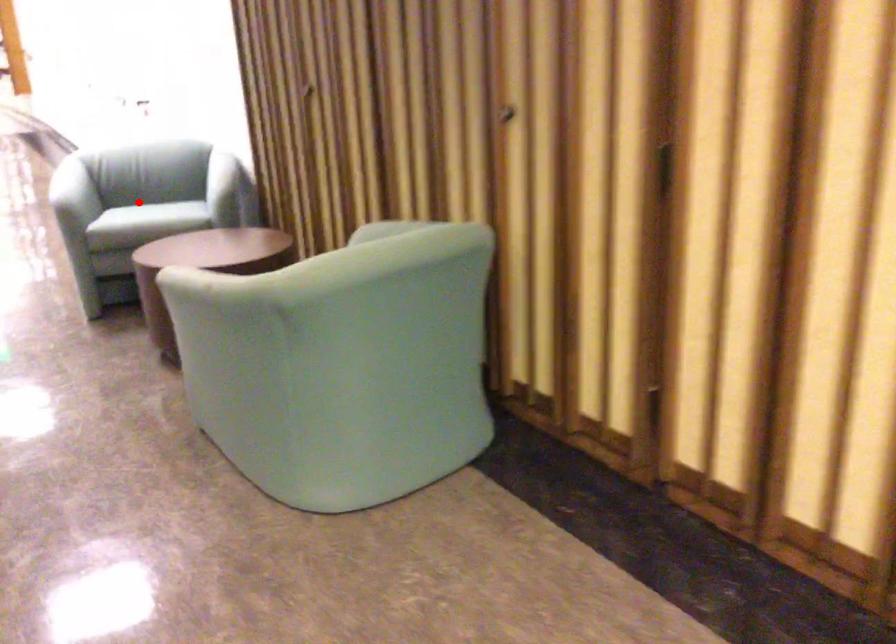
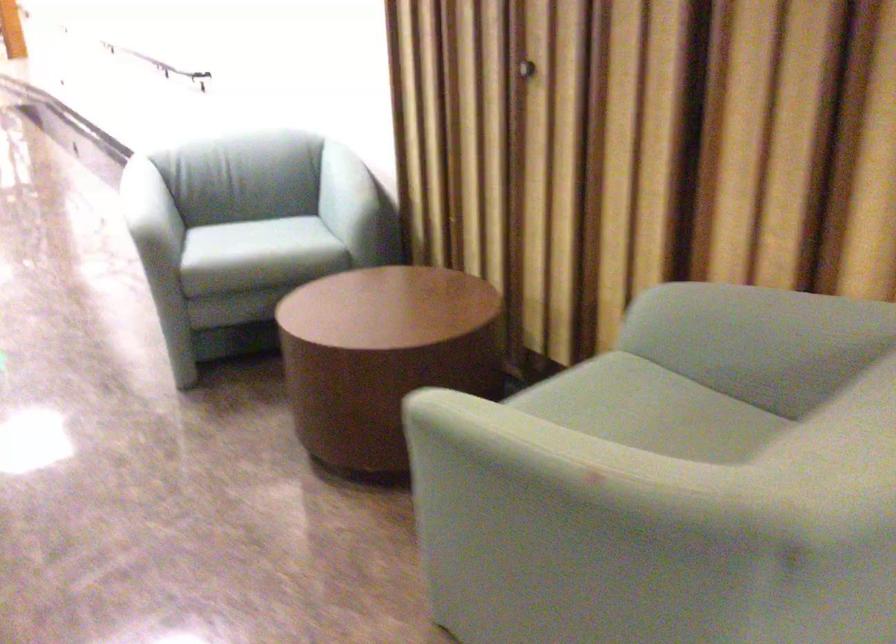
Question: I am providing you with two images of the same scene from different viewpoints. In image1, a red point is highlighted. Considering the same 3D point in image2, which of the following is correct?

Choices:
 (A) It is closer
 (B) It is farther

Answer: (A)